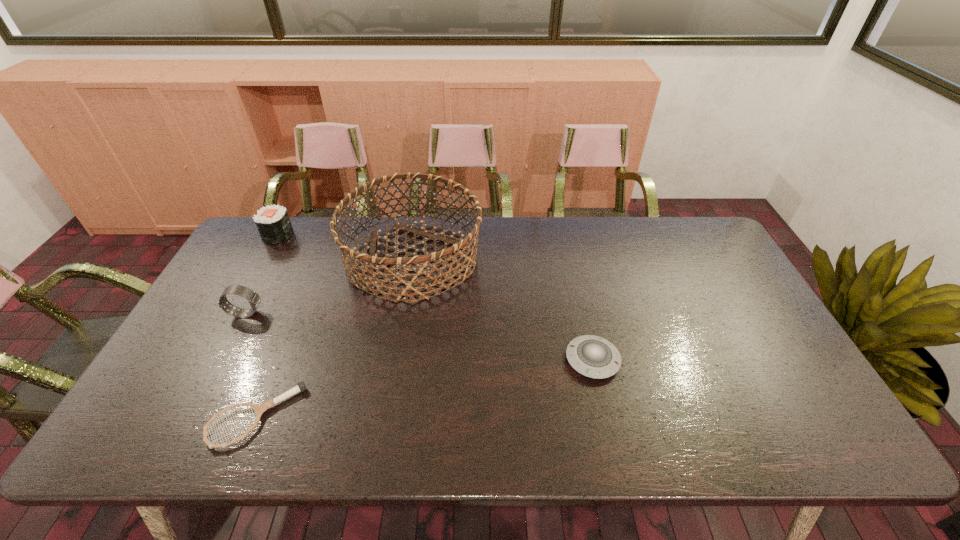
The image size is (960, 540). What are the coordinates of `vacant space at the left edge of the desktop` in the screenshot? It's located at (247, 331).

In the image, there is a desktop. At what (x,y) coordinates should I click in order to perform the action: click on vacant space at the far right corner. Please return your answer as a coordinate pair (x, y). Image resolution: width=960 pixels, height=540 pixels. Looking at the image, I should click on (700, 221).

This screenshot has width=960, height=540. I want to click on vacant space that's between the watch and the fourth farthest object, so click(420, 336).

I want to click on unoccupied position between the nearest object and the tallest object, so pyautogui.click(x=335, y=338).

Image resolution: width=960 pixels, height=540 pixels. I want to click on free area in between the nearest object and the saucer, so (424, 388).

Identify the location of vacant area that lies between the nearest object and the sushi. The image size is (960, 540). (267, 326).

Where is `free space between the nearest object and the basket`? The image size is (960, 540). free space between the nearest object and the basket is located at coordinates (335, 338).

Identify the location of free space between the tennis racket and the sushi. (267, 326).

This screenshot has height=540, width=960. I want to click on free spot between the watch and the tennis racket, so click(252, 365).

Where is `unoccupied area between the basket and the tennis racket`? unoccupied area between the basket and the tennis racket is located at coordinates (335, 338).